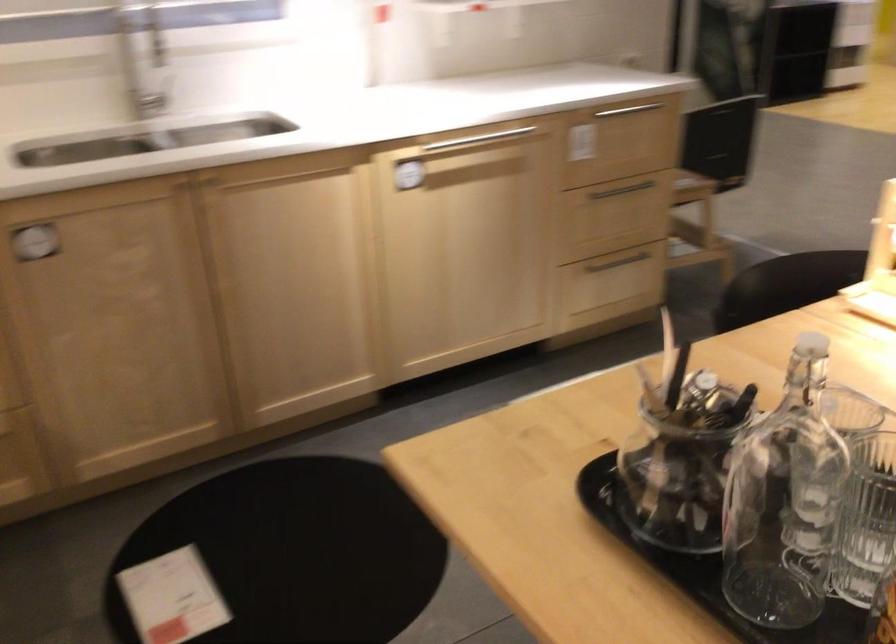
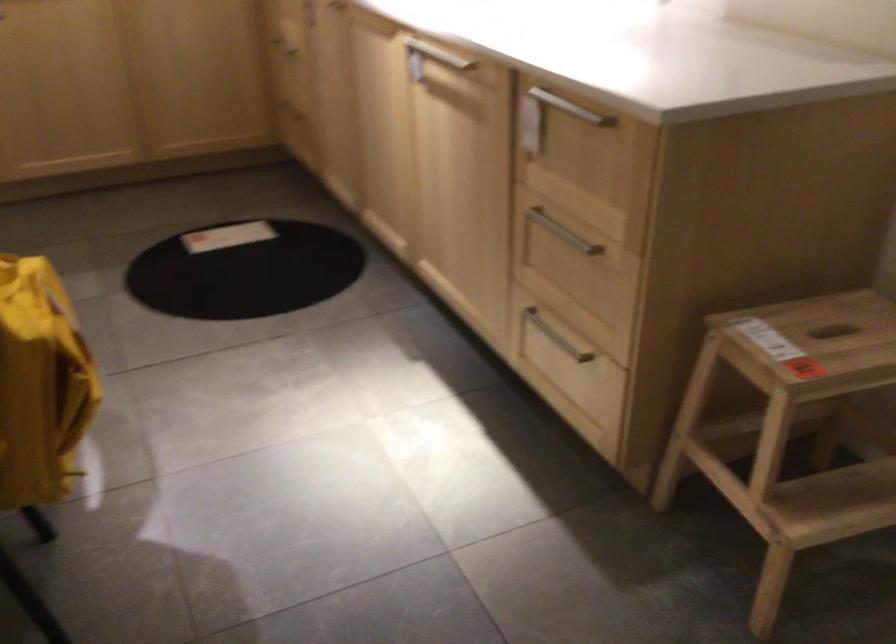
Locate, in the second image, the point that corresponds to pixel 679 288 in the first image.

(739, 527)